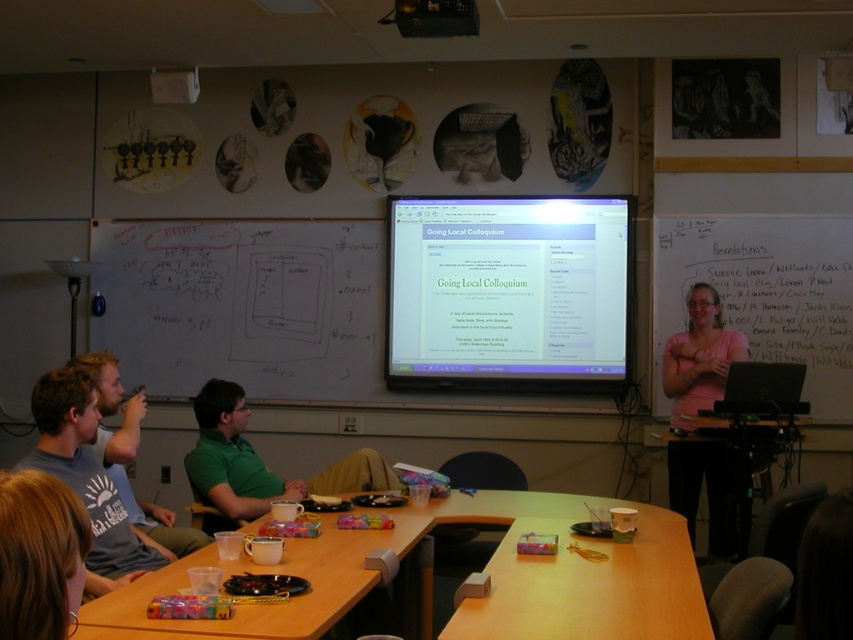
Question: Which of these objects is positioned farthest from the matte plastic projector screen at center?

Choices:
 (A) green matte shirt at center
 (B) wooden table at center

Answer: (B)

Question: Which point is closer to the camera?

Choices:
 (A) (538, 576)
 (B) (100, 490)
 (C) (126, 435)

Answer: (A)

Question: Considering the real-world distances, which object is farthest from the gray cotton shirt at left?

Choices:
 (A) pink cotton shirt at upper right
 (B) green matte shirt at center
 (C) black plastic projector at upper center
 (D) wooden table at center

Answer: (A)

Question: Is whiteboard at upper right in front of black plastic projector at upper center?

Choices:
 (A) no
 (B) yes

Answer: (A)

Question: Can you confirm if matte plastic projector screen at center is wider than pink cotton shirt at upper right?

Choices:
 (A) no
 (B) yes

Answer: (B)

Question: Is wooden table at lower left positioned in front of wooden table at center?

Choices:
 (A) yes
 (B) no

Answer: (A)